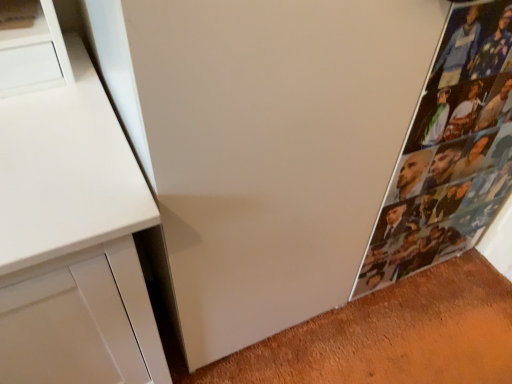
Locate an element on the screen. The width and height of the screenshot is (512, 384). free space in front of printed paper collage at right is located at coordinates (428, 334).